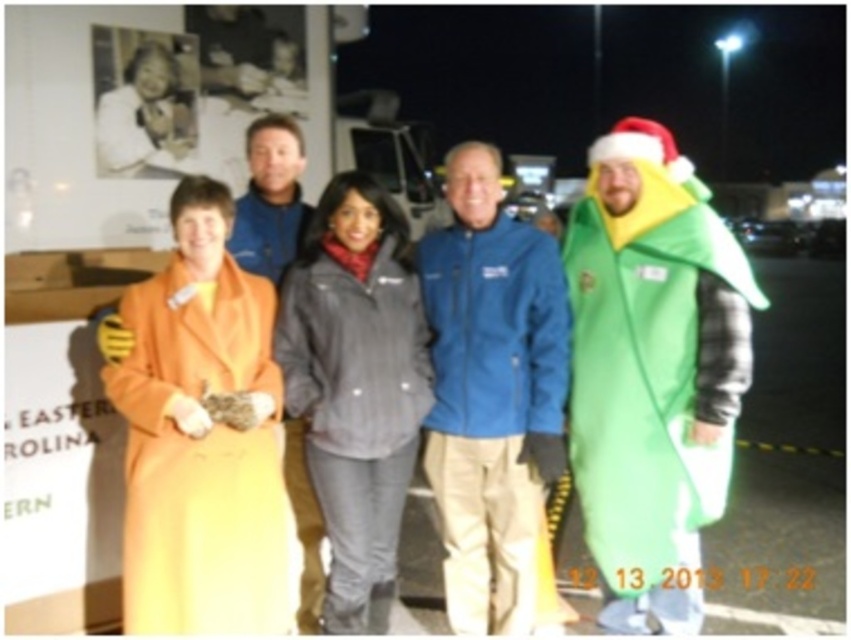
How far apart are the blue softshell jacket at center and the person wearing a bright orange jumpsuit with a yellow hood?

The blue softshell jacket at center and the person wearing a bright orange jumpsuit with a yellow hood are 9.08 feet apart.

You are standing at the point marked as point (x=570, y=276) and want to move to the other side of the group. The distance between you and the nearest person is 3.06 meters. Can you safely walk through without getting too close?

The distance between you and the nearest person is 3.06 meters, which is sufficient to safely walk through without getting too close.

You are a photographer trying to adjust the lighting for a photo of the gray synthetic jacket at center and the blue fleece jacket at center. Since the lighting is uneven, you need to know their positions relative to each other. Which jacket is positioned lower in the image?

The gray synthetic jacket at center is located below the blue fleece jacket at center, so it is positioned lower in the image.